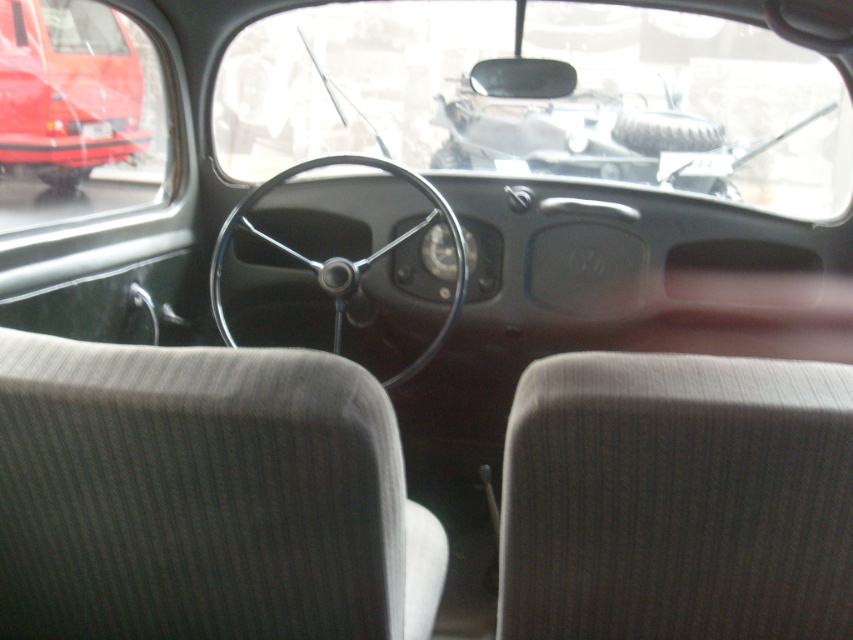
You are a mechanic working on a vintage car. You need to access the metallic gray engine at center for maintenance. The tools you have are placed 3 meters away from you. Can you reach the engine without moving your tools?

The metallic gray engine at center is 3.52 meters from camera. Since your tools are placed 3 meters away from you, you cannot reach the engine without moving your tools because the engine is farther than the tools.

You are a mechanic trying to access the engine compartment of the matte red car at left. You need to move the black metallic steering wheel at center out of the way. Is the steering wheel close enough to the car to be moved without needing to go around it?

The distance between the matte red car at left and the black metallic steering wheel at center is 8.67 feet. Since the steering wheel is part of the car itself, it is already attached and positioned within the car, so you don not need to move it out of the way to access the engine compartment. The distance measurement here likely refers to the space between the car body and the steering wheel, which is standard and does not require relocation for engine access.

You are sitting in the driver seat of the vintage car and want to look at the metallic gray engine at center and the matte red car at left. Which one is closer to you?

The metallic gray engine at center is closer to you because it is in front of the matte red car at left.